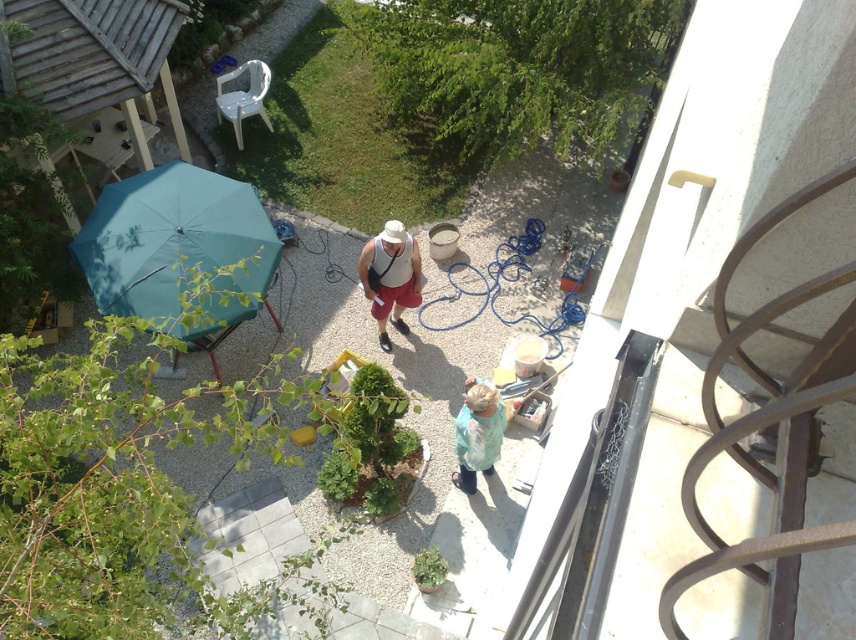
Question: Which is nearer to the matte white tank top at center?

Choices:
 (A) teal fabric umbrella at left
 (B) light blue fabric at center

Answer: (A)

Question: Estimate the real-world distances between objects in this image. Which object is farther from the teal fabric umbrella at left?

Choices:
 (A) matte white tank top at center
 (B) light blue fabric at center

Answer: (B)

Question: Which of the following is the closest to the observer?

Choices:
 (A) (402, 276)
 (B) (183, 170)

Answer: (A)

Question: Does teal fabric umbrella at left appear over matte white tank top at center?

Choices:
 (A) yes
 (B) no

Answer: (A)

Question: Is teal fabric umbrella at left to the left of matte white tank top at center from the viewer's perspective?

Choices:
 (A) yes
 (B) no

Answer: (A)

Question: Is teal fabric umbrella at left thinner than matte white tank top at center?

Choices:
 (A) yes
 (B) no

Answer: (B)